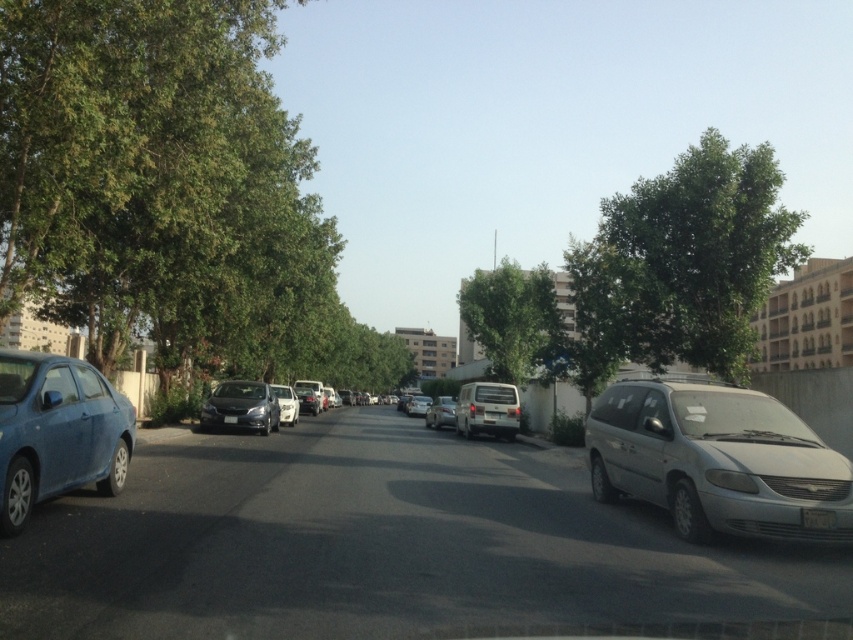
Question: Where is white matte van at center located in relation to white plastic license plate at center in the image?

Choices:
 (A) left
 (B) right

Answer: (B)

Question: Which of the following is the farthest from the observer?

Choices:
 (A) (223, 394)
 (B) (306, 400)

Answer: (B)

Question: Among these points, which one is nearest to the camera?

Choices:
 (A) (432, 416)
 (B) (476, 426)
 (C) (817, 513)

Answer: (C)

Question: Is silver metallic minivan at right smaller than white plastic van at center?

Choices:
 (A) yes
 (B) no

Answer: (B)

Question: Estimate the real-world distances between objects in this image. Which object is farther from the green leafy tree at left?

Choices:
 (A) white plastic license plate at lower right
 (B) metallic blue sedan at left
 (C) green leafy tree at upper right

Answer: (C)

Question: Can you confirm if silver metallic van at center is positioned above white plastic license plate at lower right?

Choices:
 (A) yes
 (B) no

Answer: (B)